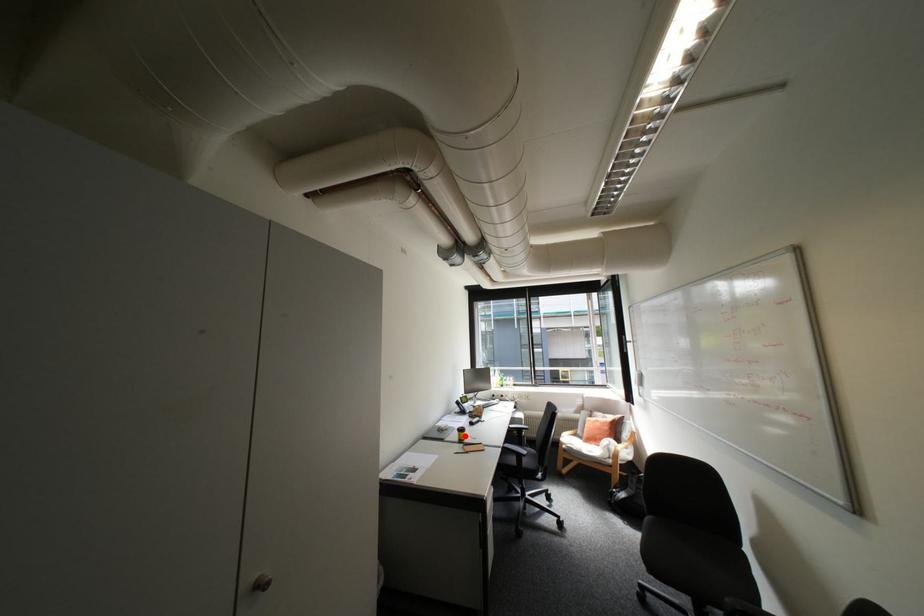
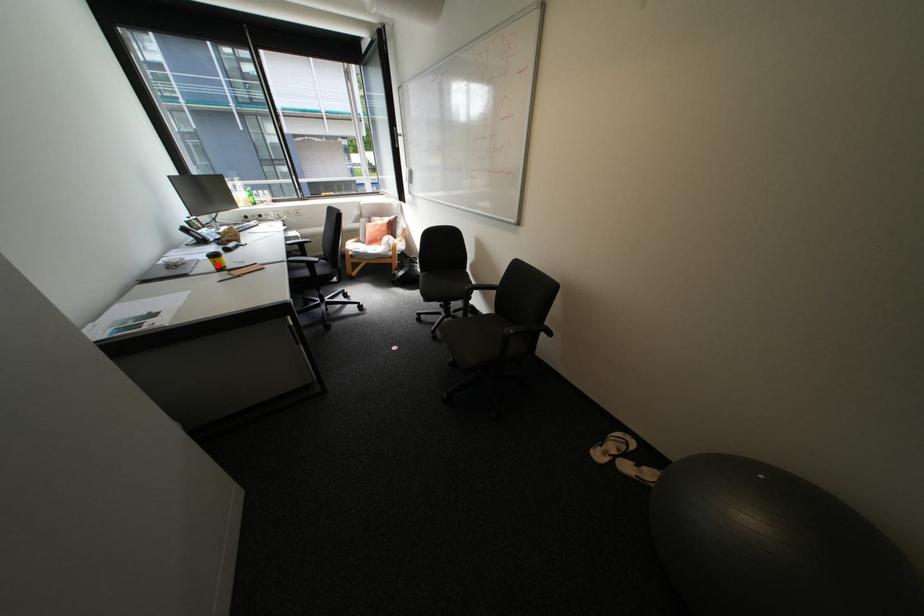
I am providing you with two images of the same scene from different viewpoints. A red point is marked on the first image and another point is marked on the second image. Does the point marked in image1 correspond to the same location as the one in image2?

Yes